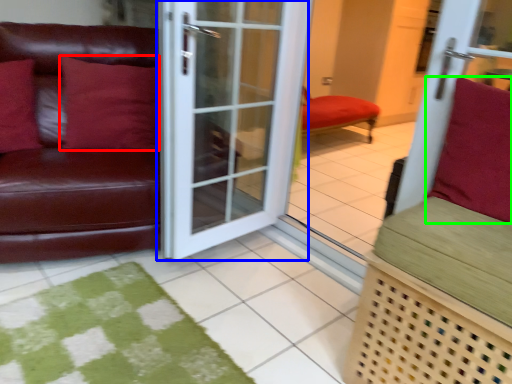
Question: Based on their relative distances, which object is farther from pillow (highlighted by a red box)? Choose from door (highlighted by a blue box) and pillow (highlighted by a green box).

Choices:
 (A) door
 (B) pillow

Answer: (B)